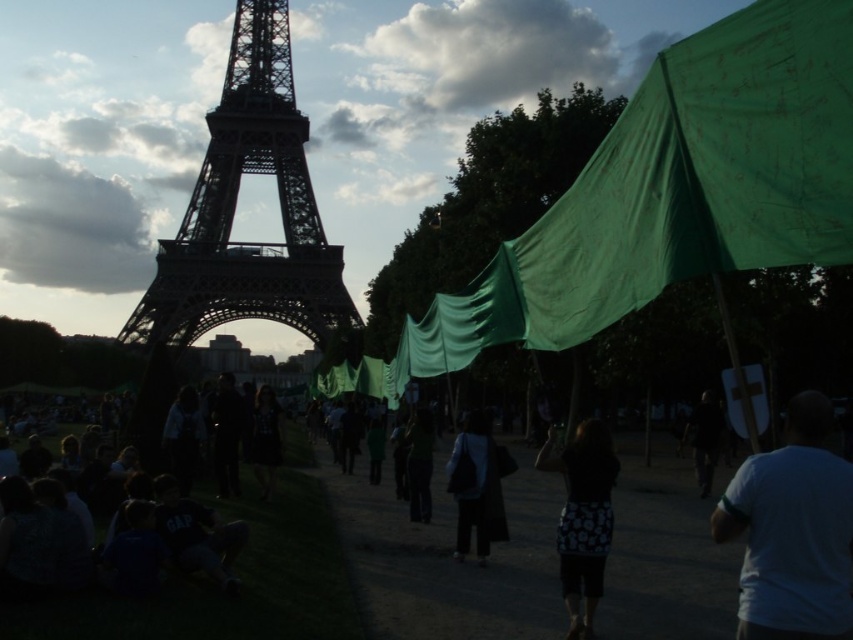
Question: Which object appears farthest from the camera in this image?

Choices:
 (A) dark gray fabric bag at center
 (B) black fabric skirt at lower center

Answer: (A)

Question: Which point is closer to the camera?

Choices:
 (A) dark gray fabric bag at center
 (B) white matte t-shirt at lower right

Answer: (B)

Question: Does dark steel eiffel tower at center have a lesser width compared to dark gray fabric bag at center?

Choices:
 (A) yes
 (B) no

Answer: (B)

Question: Is green fabric canopy at right to the right of black fabric skirt at lower center from the viewer's perspective?

Choices:
 (A) yes
 (B) no

Answer: (A)

Question: Is green fabric canopy at right closer to the viewer compared to dark fabric bag at center?

Choices:
 (A) no
 (B) yes

Answer: (B)

Question: Which point is closer to the camera taking this photo?

Choices:
 (A) (329, 564)
 (B) (734, 477)
 (C) (457, 552)
 (D) (767, 116)

Answer: (D)